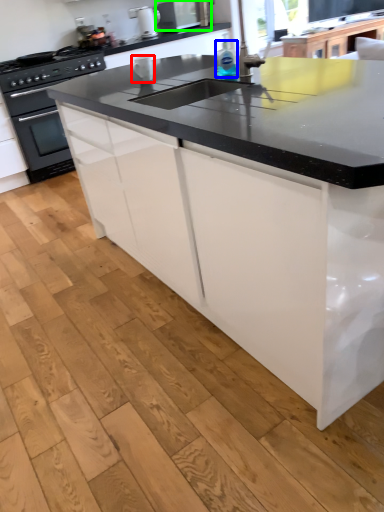
Question: Based on their relative distances, which object is nearer to appliance (highlighted by a red box)? Choose from bottle (highlighted by a blue box) and kitchen appliance (highlighted by a green box).

Choices:
 (A) bottle
 (B) kitchen appliance

Answer: (A)